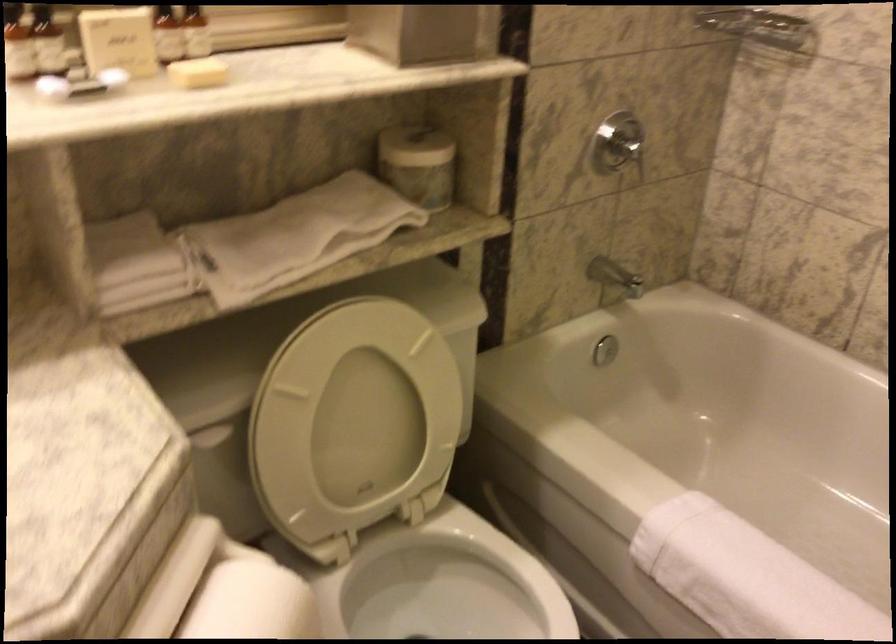
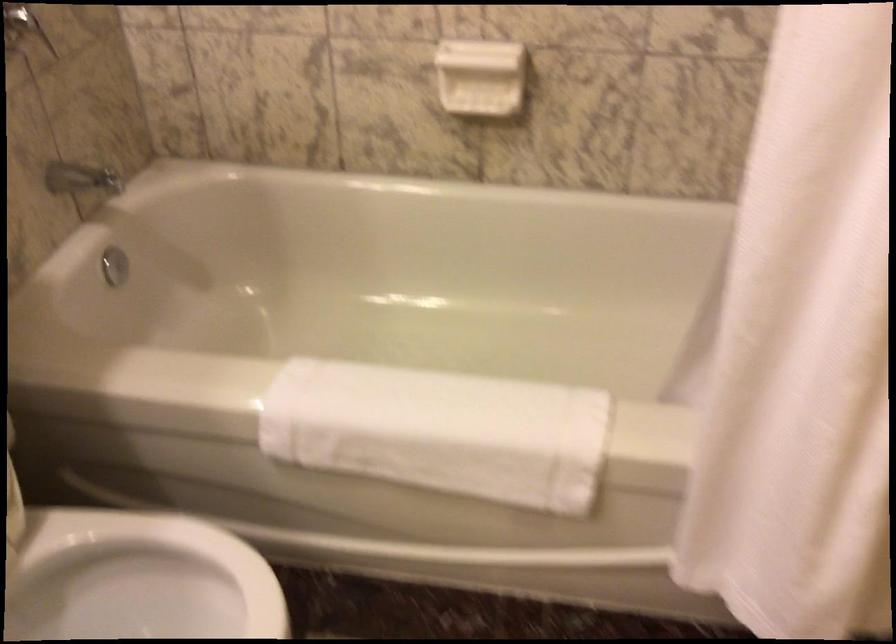
Question: The camera is either moving clockwise (left) or counter-clockwise (right) around the object. The first image is from the beginning of the video and the second image is from the end. Is the camera moving left or right when shooting the video?

Choices:
 (A) Left
 (B) Right

Answer: (A)